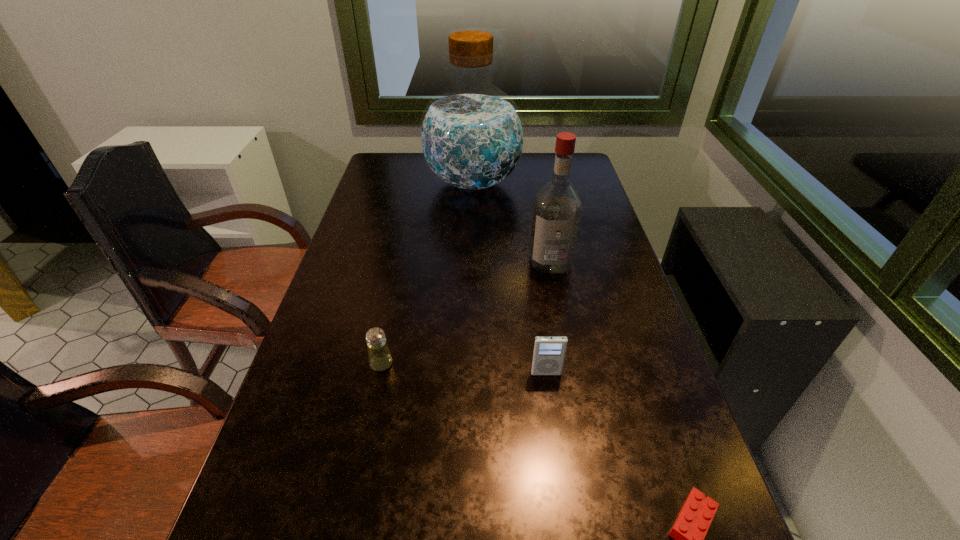
This screenshot has width=960, height=540. Find the location of `the tallest object`. the tallest object is located at coordinates (471, 135).

This screenshot has height=540, width=960. I want to click on water jug, so click(x=471, y=135).

In order to click on the second farthest object in this screenshot , I will do `click(557, 210)`.

Locate an element on the screen. This screenshot has height=540, width=960. liquor is located at coordinates (557, 210).

The height and width of the screenshot is (540, 960). Identify the location of iPod. (549, 352).

This screenshot has height=540, width=960. I want to click on saltshaker, so click(380, 359).

Find the location of `free space located 0.110m on the front of the water jug`. free space located 0.110m on the front of the water jug is located at coordinates (471, 229).

Locate an element on the screen. The height and width of the screenshot is (540, 960). blank area located 0.340m on the front-facing side of the fourth shortest object is located at coordinates (572, 375).

Where is `vacant space located 0.260m on the front-facing side of the iPod`? The image size is (960, 540). vacant space located 0.260m on the front-facing side of the iPod is located at coordinates (564, 498).

This screenshot has width=960, height=540. Find the location of `free space located on the front of the saltshaker`. free space located on the front of the saltshaker is located at coordinates (356, 482).